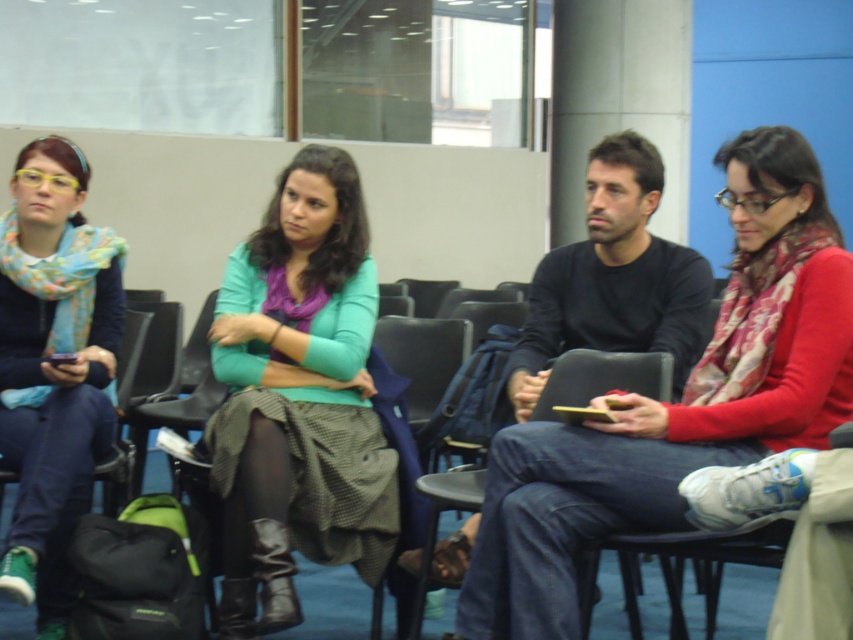
Which of these two, teal sweater at center or black matte sweater at center, stands shorter?

Standing shorter between the two is black matte sweater at center.

Is teal sweater at center taller than black matte sweater at center?

Yes.

At what (x,y) coordinates should I click in order to perform the action: click on teal sweater at center. Please return your answer as a coordinate pair (x, y). This screenshot has height=640, width=853. Looking at the image, I should click on (299, 397).

Who is more forward, (78,486) or (621,282)?

Point (78,486) is in front.

Between point (68, 344) and point (538, 272), which one is positioned behind?

The point (68, 344) is more distant.

Identify the location of matte blue scarf at left. The width and height of the screenshot is (853, 640). (53, 365).

Identify the location of matte blue scarf at left. (53, 365).

What do you see at coordinates (299, 397) in the screenshot? This screenshot has width=853, height=640. I see `teal sweater at center` at bounding box center [299, 397].

Can you confirm if teal sweater at center is bigger than matte blue scarf at left?

Yes, teal sweater at center is bigger than matte blue scarf at left.

Find the location of a particular element. The height and width of the screenshot is (640, 853). teal sweater at center is located at coordinates (299, 397).